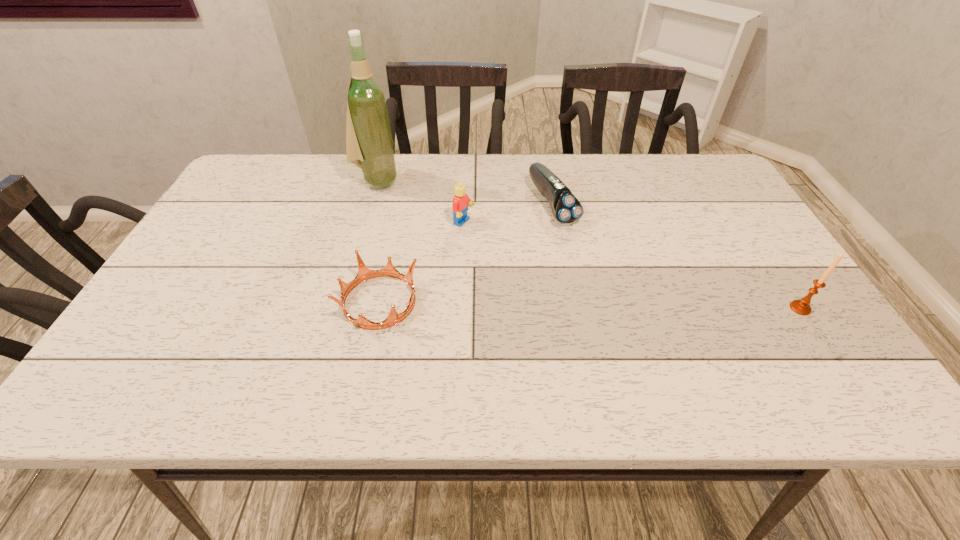
This screenshot has height=540, width=960. Find the location of `free region located 0.200m on the face of the Lego`. free region located 0.200m on the face of the Lego is located at coordinates (539, 258).

Locate an element on the screen. free region located on the face of the Lego is located at coordinates (564, 269).

This screenshot has width=960, height=540. In order to click on vacant region located on the front-facing side of the tallest object in this screenshot , I will do `click(420, 217)`.

This screenshot has width=960, height=540. What are the coordinates of `vacant space situated 0.050m on the front-facing side of the tallest object` in the screenshot? It's located at (398, 198).

You are a GUI agent. You are given a task and a screenshot of the screen. Output one action in this format:
    pyautogui.click(x=<x>, y=<y>)
    Task: Click on the free spot located 0.180m on the front-facing side of the tallest object
    The image size is (960, 540).
    Given the screenshot: What is the action you would take?
    pyautogui.click(x=424, y=220)

Identify the location of free spot located 0.170m on the head of the fourth object from left to right. Image resolution: width=960 pixels, height=540 pixels. (601, 271).

Identify the location of free space located 0.350m on the head of the fourth object from left to right. (644, 327).

Find the location of `vacant area located 0.130m on the head of the fourth object from left to right`. vacant area located 0.130m on the head of the fourth object from left to right is located at coordinates (592, 260).

Where is `wine bottle that is positioned at the far edge`? The width and height of the screenshot is (960, 540). wine bottle that is positioned at the far edge is located at coordinates (369, 145).

Locate an element on the screen. The width and height of the screenshot is (960, 540). electric shaver that is at the far edge is located at coordinates (566, 208).